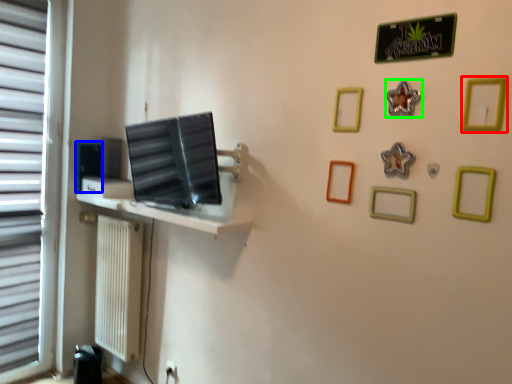
Question: Based on their relative distances, which object is farther from picture frame (highlighted by a red box)? Choose from picture frame (highlighted by a blue box) and picture frame (highlighted by a green box).

Choices:
 (A) picture frame
 (B) picture frame

Answer: (A)